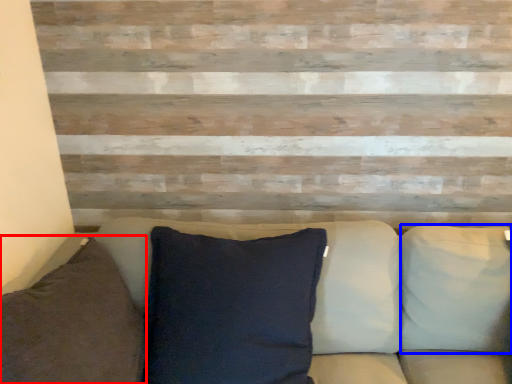
Question: Which object appears farthest to the camera in this image, pillow (highlighted by a red box) or pillow (highlighted by a blue box)?

Choices:
 (A) pillow
 (B) pillow

Answer: (B)